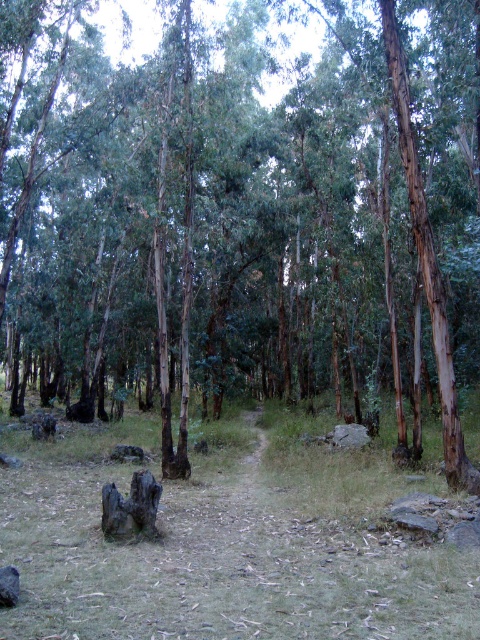
Can you confirm if charred wood stump at center is smaller than gray rough rock at center?

Indeed, charred wood stump at center has a smaller size compared to gray rough rock at center.

Which is more to the right, charred wood stump at center or gray rough rock at center?

gray rough rock at center is more to the right.

The width and height of the screenshot is (480, 640). What do you see at coordinates (131, 508) in the screenshot?
I see `charred wood stump at center` at bounding box center [131, 508].

In order to click on charred wood stump at center in this screenshot , I will do `click(131, 508)`.

Can you confirm if green grass at center is positioned to the right of charred wood stump at center?

Yes, green grass at center is to the right of charred wood stump at center.

What do you see at coordinates (219, 547) in the screenshot?
I see `green grass at center` at bounding box center [219, 547].

Where is `green grass at center`? green grass at center is located at coordinates (219, 547).

Which is behind, point (93, 435) or point (343, 424)?

The point (93, 435) is behind.

Does green grass at center appear over gray rough rock at center?

Yes, green grass at center is above gray rough rock at center.

Locate an element on the screen. green grass at center is located at coordinates (219, 547).